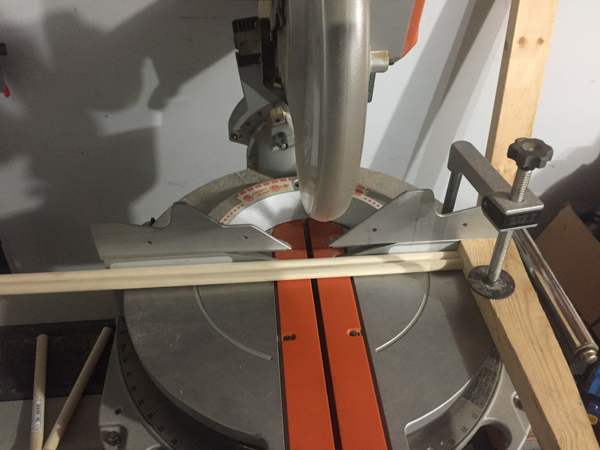
This screenshot has width=600, height=450. In order to click on sticker in this screenshot , I will do `click(271, 184)`, `click(366, 198)`.